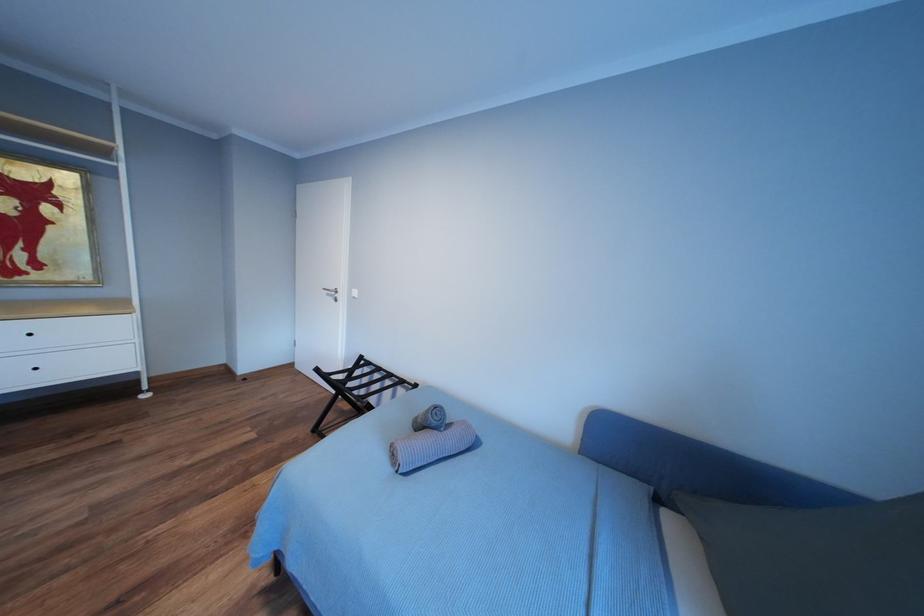
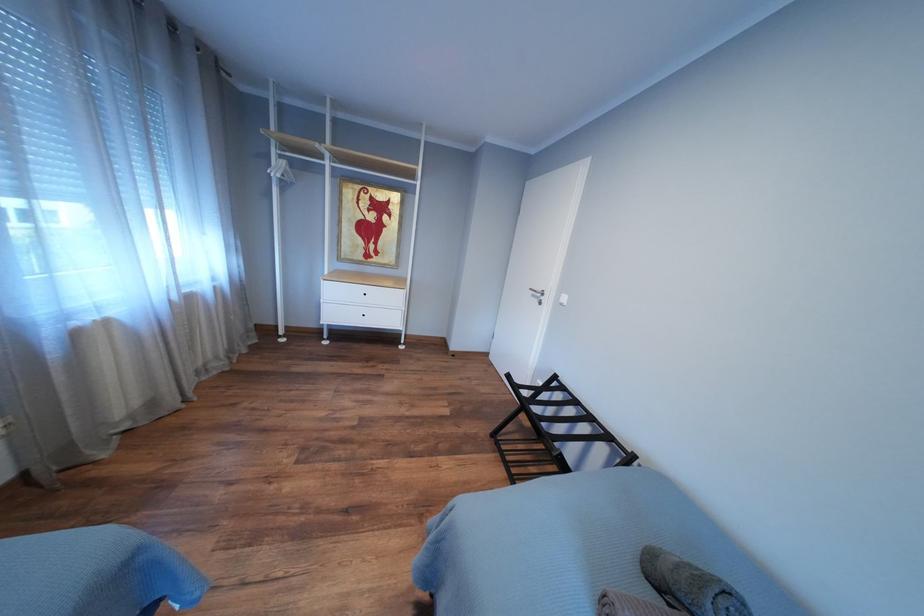
Question: The first image is from the beginning of the video and the second image is from the end. How did the camera likely rotate when shooting the video?

Choices:
 (A) Left
 (B) Right
 (C) Up
 (D) Down

Answer: (A)